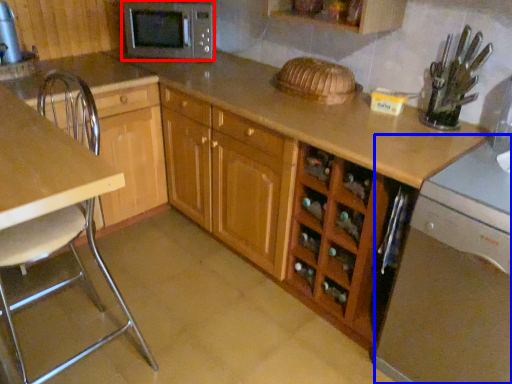
Question: Which point is further to the camera, microwave oven (highlighted by a red box) or dish washer (highlighted by a blue box)?

Choices:
 (A) microwave oven
 (B) dish washer

Answer: (A)